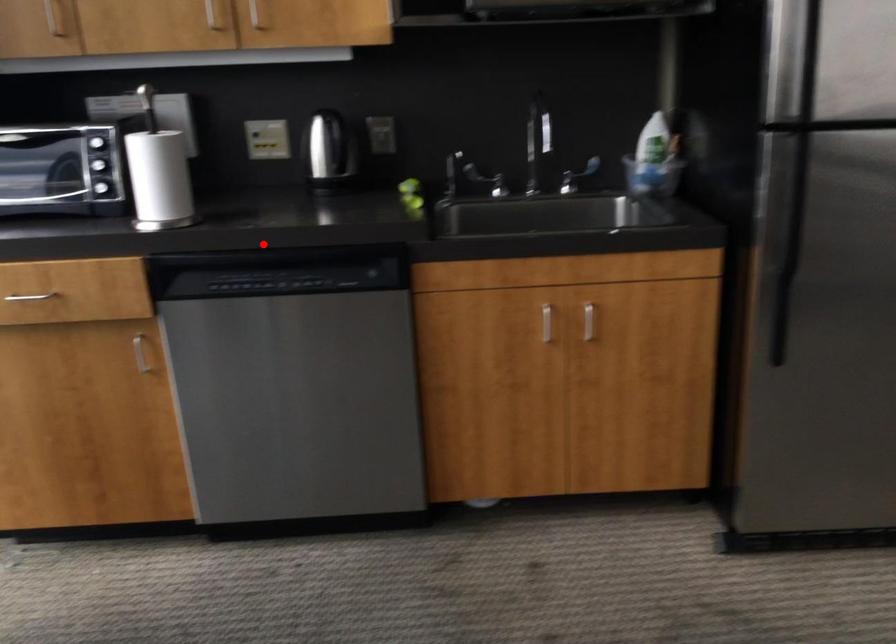
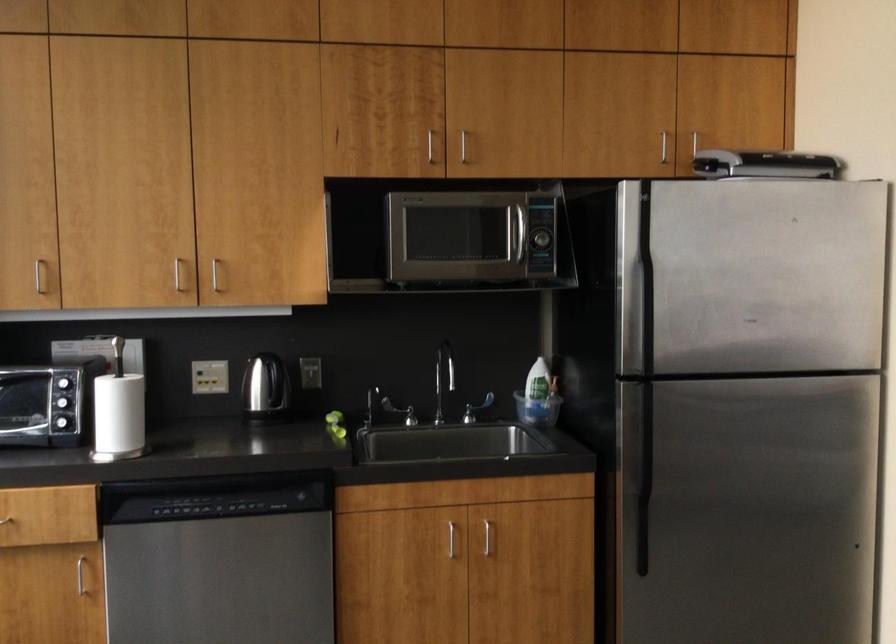
Find the pixel in the second image that matches the highlighted location in the first image.

(208, 471)